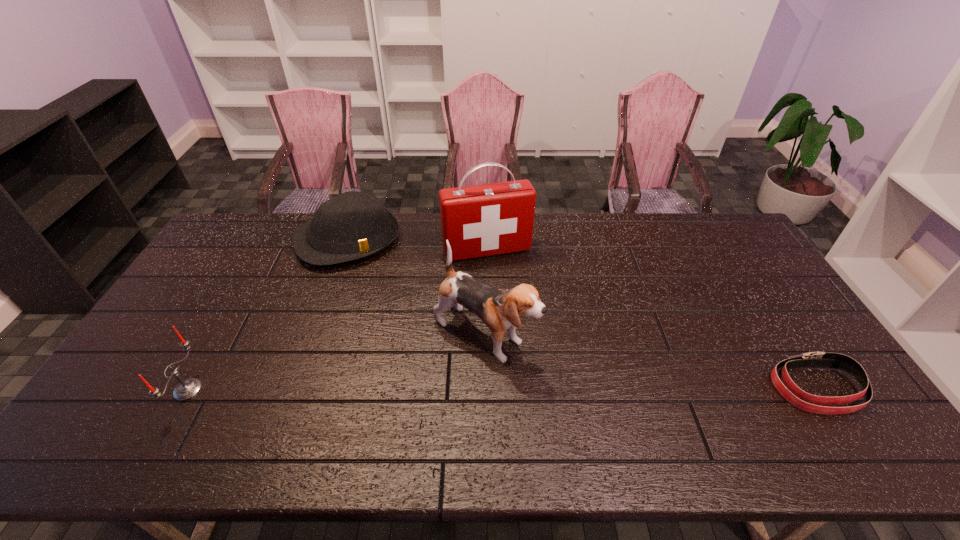
Find the location of `fedora that is at the far edge`. fedora that is at the far edge is located at coordinates (352, 225).

You are a GUI agent. You are given a task and a screenshot of the screen. Output one action in this format:
    pyautogui.click(x=<x>, y=<y>)
    Task: Click on the candle that is at the near edge
    
    Given the screenshot: What is the action you would take?
    pyautogui.click(x=187, y=389)

This screenshot has width=960, height=540. I want to click on dog collar at the near edge, so click(800, 399).

Identify the location of object present at the left edge. This screenshot has width=960, height=540. (187, 389).

At what (x,y) coordinates should I click in order to perform the action: click on object positioned at the right edge. Please return your answer as a coordinate pair (x, y). Looking at the image, I should click on (800, 399).

Locate an element on the screen. This screenshot has width=960, height=540. object that is at the near left corner is located at coordinates (187, 389).

Find the location of a particular element. Image resolution: width=960 pixels, height=540 pixels. object at the near right corner is located at coordinates (800, 399).

Locate an element on the screen. Image resolution: width=960 pixels, height=540 pixels. vacant region at the far edge of the desktop is located at coordinates (620, 229).

Find the location of a particular element. free spot at the near edge of the desktop is located at coordinates (x=490, y=404).

Where is `free space at the left edge of the desktop`? free space at the left edge of the desktop is located at coordinates (221, 264).